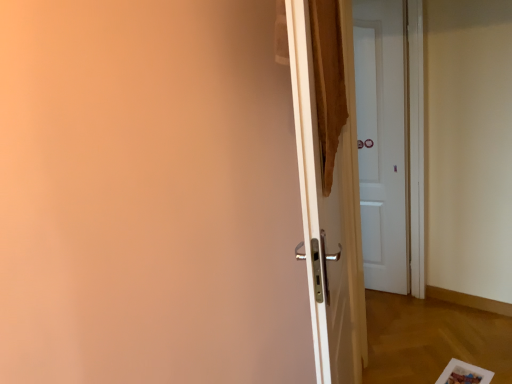
What is the approximate height of white glossy door at center, the first door when ordered from left to right?

white glossy door at center, the first door when ordered from left to right, is 1.81 meters in height.

Describe the element at coordinates (329, 208) in the screenshot. I see `white glossy door at center, which is the 2th door from right to left` at that location.

You are a GUI agent. You are given a task and a screenshot of the screen. Output one action in this format:
    pyautogui.click(x=<x>, y=<y>)
    Task: Click on the white glossy door at center, positioned as the 1th door in front-to-back order
    The width and height of the screenshot is (512, 384).
    Given the screenshot: What is the action you would take?
    pyautogui.click(x=329, y=208)

Consider the image. In order to face white matte door at center, which is counted as the 2th door, starting from the left, should I rotate leftwards or rightwards?

It's best to rotate right around 16.874 degrees.

Find the location of a particular element. This screenshot has height=384, width=512. white matte door at center, which is the 2th door from front to back is located at coordinates (381, 141).

What do you see at coordinates (381, 141) in the screenshot? This screenshot has height=384, width=512. I see `white matte door at center, which ranks as the first door in right-to-left order` at bounding box center [381, 141].

At what (x,y) coordinates should I click in order to perform the action: click on white glossy door at center, the second door from the back. Please return your answer as a coordinate pair (x, y). The image size is (512, 384). Looking at the image, I should click on (329, 208).

Between white glossy door at center, positioned as the 1th door in front-to-back order, and white matte door at center, which ranks as the first door in right-to-left order, which one appears on the right side from the viewer's perspective?

From the viewer's perspective, white matte door at center, which ranks as the first door in right-to-left order, appears more on the right side.

Considering the positions of objects white glossy door at center, which is the 2th door from right to left, and white matte door at center, which is the 2th door from front to back, in the image provided, who is behind, white glossy door at center, which is the 2th door from right to left, or white matte door at center, which is the 2th door from front to back,?

white matte door at center, which is the 2th door from front to back, is further away from the camera.

Is point (294, 79) less distant than point (372, 84)?

Yes, point (294, 79) is in front of point (372, 84).

From the image's perspective, is white glossy door at center, the second door from the back, located beneath white matte door at center, which is the 2th door from front to back?

Yes, from the image's perspective, white glossy door at center, the second door from the back, is below white matte door at center, which is the 2th door from front to back.

From a real-world perspective, is white glossy door at center, the second door from the back, physically located above or below white matte door at center, which is the 2th door from front to back?

Clearly, from a real-world perspective, white glossy door at center, the second door from the back, is below white matte door at center, which is the 2th door from front to back.

Can you confirm if white glossy door at center, positioned as the 1th door in front-to-back order, is thinner than white matte door at center, which is counted as the 2th door, starting from the left?

Indeed, white glossy door at center, positioned as the 1th door in front-to-back order, has a lesser width compared to white matte door at center, which is counted as the 2th door, starting from the left.

In terms of height, does white glossy door at center, the second door from the back, look taller or shorter compared to white matte door at center, which is counted as the 2th door, starting from the left?

Considering their sizes, white glossy door at center, the second door from the back, has less height than white matte door at center, which is counted as the 2th door, starting from the left.

Between white glossy door at center, which is the 2th door from right to left, and white matte door at center, which is counted as the 2th door, starting from the left, which one has smaller size?

With smaller size is white matte door at center, which is counted as the 2th door, starting from the left.

Is white matte door at center, which is the first door in back-to-front order, surrounded by white glossy door at center, which is the 2th door from right to left?

That's incorrect, white matte door at center, which is the first door in back-to-front order, is not inside white glossy door at center, which is the 2th door from right to left.

Is the surface of white glossy door at center, the first door when ordered from left to right, in direct contact with white matte door at center, which is counted as the 2th door, starting from the left?

No, white glossy door at center, the first door when ordered from left to right, is not touching white matte door at center, which is counted as the 2th door, starting from the left.

Is white glossy door at center, positioned as the 1th door in front-to-back order, positioned with its back to white matte door at center, which is the first door in back-to-front order?

No.

How different are the orientations of white glossy door at center, which is the 2th door from right to left, and white matte door at center, which ranks as the first door in right-to-left order, in degrees?

The angular difference between white glossy door at center, which is the 2th door from right to left, and white matte door at center, which ranks as the first door in right-to-left order, is 103 degrees.

The height and width of the screenshot is (384, 512). Identify the location of door behind the white glossy door at center, the first door when ordered from left to right. (381, 141).

Does white matte door at center, which is the 2th door from front to back, appear on the left side of white glossy door at center, the first door when ordered from left to right?

No.

Which object is further away from the camera, white matte door at center, which is the 2th door from front to back, or white glossy door at center, the first door when ordered from left to right?

white matte door at center, which is the 2th door from front to back, is more distant.

Considering the points (361, 201) and (316, 328), which point is behind, point (361, 201) or point (316, 328)?

The point (361, 201) is more distant.

From the image's perspective, is white matte door at center, which is the 2th door from front to back, below white glossy door at center, the second door from the back?

No, from the image's perspective, white matte door at center, which is the 2th door from front to back, is not below white glossy door at center, the second door from the back.

Consider the image. From a real-world perspective, which object rests below the other?

white glossy door at center, which is the 2th door from right to left.

Does white matte door at center, which is the 2th door from front to back, have a greater width compared to white glossy door at center, the first door when ordered from left to right?

Correct, the width of white matte door at center, which is the 2th door from front to back, exceeds that of white glossy door at center, the first door when ordered from left to right.

From their relative heights in the image, would you say white matte door at center, which is the first door in back-to-front order, is taller or shorter than white glossy door at center, which is the 2th door from right to left?

Clearly, white matte door at center, which is the first door in back-to-front order, is taller compared to white glossy door at center, which is the 2th door from right to left.

Which of these two, white matte door at center, which is the first door in back-to-front order, or white glossy door at center, which is the 2th door from right to left, is smaller?

Smaller between the two is white matte door at center, which is the first door in back-to-front order.

Based on the photo, is white matte door at center, which is the first door in back-to-front order, inside the boundaries of white glossy door at center, which is the 2th door from right to left, or outside?

white matte door at center, which is the first door in back-to-front order, is not enclosed by white glossy door at center, which is the 2th door from right to left.

Is white matte door at center, which is the first door in back-to-front order, next to white glossy door at center, positioned as the 1th door in front-to-back order, and touching it?

They are not placed beside each other.

Based on the photo, is white matte door at center, which is the 2th door from front to back, positioned with its back to white glossy door at center, which is the 2th door from right to left?

That's not correct — white matte door at center, which is the 2th door from front to back, is not looking away from white glossy door at center, which is the 2th door from right to left.

Image resolution: width=512 pixels, height=384 pixels. I want to click on door located behind the white glossy door at center, positioned as the 1th door in front-to-back order, so click(381, 141).

Locate an element on the screen. door on the left of white matte door at center, which ranks as the first door in right-to-left order is located at coordinates (329, 208).

The image size is (512, 384). I want to click on door in front of the white matte door at center, which is counted as the 2th door, starting from the left, so tap(329, 208).